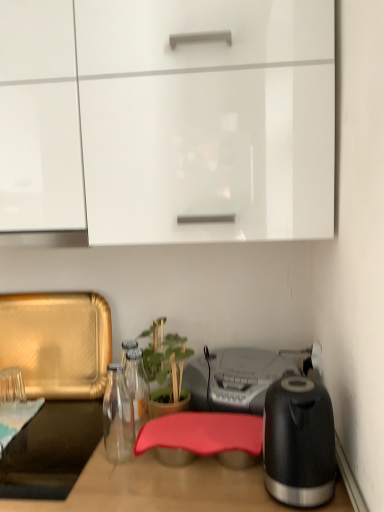
Question: Would you say metallic silver radio at center is part of green matte plant at center's contents?

Choices:
 (A) no
 (B) yes

Answer: (A)

Question: Is metallic silver radio at center at the back of green matte plant at center?

Choices:
 (A) no
 (B) yes

Answer: (B)

Question: From a real-world perspective, is green matte plant at center positioned over metallic silver radio at center based on gravity?

Choices:
 (A) no
 (B) yes

Answer: (B)

Question: Is the position of green matte plant at center less distant than that of metallic silver radio at center?

Choices:
 (A) yes
 (B) no

Answer: (A)

Question: Is green matte plant at center touching metallic silver radio at center?

Choices:
 (A) yes
 (B) no

Answer: (B)

Question: Is green matte plant at center at the right side of metallic silver radio at center?

Choices:
 (A) yes
 (B) no

Answer: (B)

Question: From a real-world perspective, is black glossy electric kettle at right physically below white glossy cabinet at upper center?

Choices:
 (A) no
 (B) yes

Answer: (B)

Question: Is black glossy electric kettle at right looking in the opposite direction of white glossy cabinet at upper center?

Choices:
 (A) no
 (B) yes

Answer: (A)

Question: Can you confirm if black glossy electric kettle at right is thinner than white glossy cabinet at upper center?

Choices:
 (A) no
 (B) yes

Answer: (B)

Question: Can you confirm if black glossy electric kettle at right is taller than white glossy cabinet at upper center?

Choices:
 (A) yes
 (B) no

Answer: (B)

Question: Considering the relative positions of black glossy electric kettle at right and white glossy cabinet at upper center in the image provided, is black glossy electric kettle at right behind white glossy cabinet at upper center?

Choices:
 (A) yes
 (B) no

Answer: (B)

Question: Considering the relative sizes of black glossy electric kettle at right and white glossy cabinet at upper center in the image provided, is black glossy electric kettle at right shorter than white glossy cabinet at upper center?

Choices:
 (A) yes
 (B) no

Answer: (A)

Question: From the image's perspective, is white glossy cabinet at upper center located beneath green matte plant at center?

Choices:
 (A) yes
 (B) no

Answer: (B)